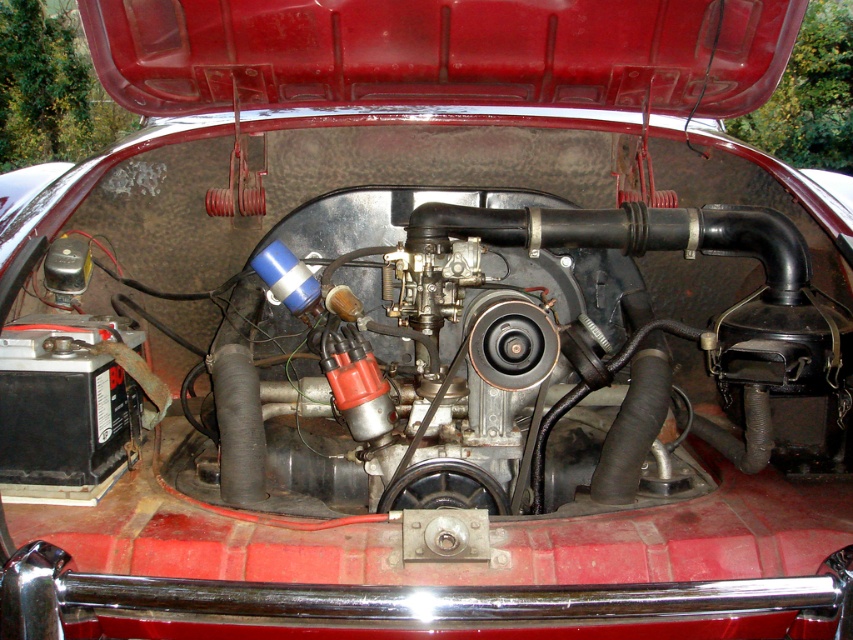
Who is positioned more to the left, metallic silver engine at center or smooth red hood at upper center?

smooth red hood at upper center is more to the left.

The width and height of the screenshot is (853, 640). I want to click on metallic silver engine at center, so click(459, 376).